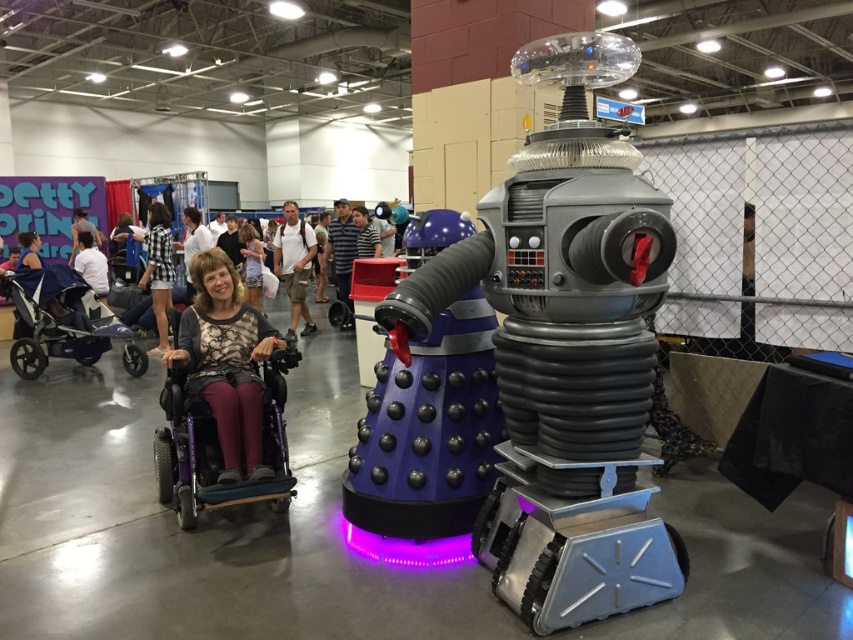
Who is more distant from viewer, [213,390] or [96,260]?

Positioned behind is point [96,260].

Is point (260, 378) closer to viewer compared to point (97, 296)?

That is True.

This screenshot has width=853, height=640. I want to click on matte purple wheelchair at left, so click(225, 364).

Based on the photo, who is more distant from viewer, (x=264, y=396) or (x=53, y=337)?

Positioned behind is point (x=53, y=337).

Where is `purple matte wheelchair at lower left`? The height and width of the screenshot is (640, 853). purple matte wheelchair at lower left is located at coordinates (218, 445).

Between point (207, 355) and point (260, 260), which one is positioned in front?

Point (207, 355) is more forward.

Which is below, matte purple wheelchair at left or matte black wheelchair at center?

matte purple wheelchair at left is lower down.

Who is more forward, (257, 408) or (258, 289)?

Point (257, 408)

Identify the location of matte purple wheelchair at left. (225, 364).